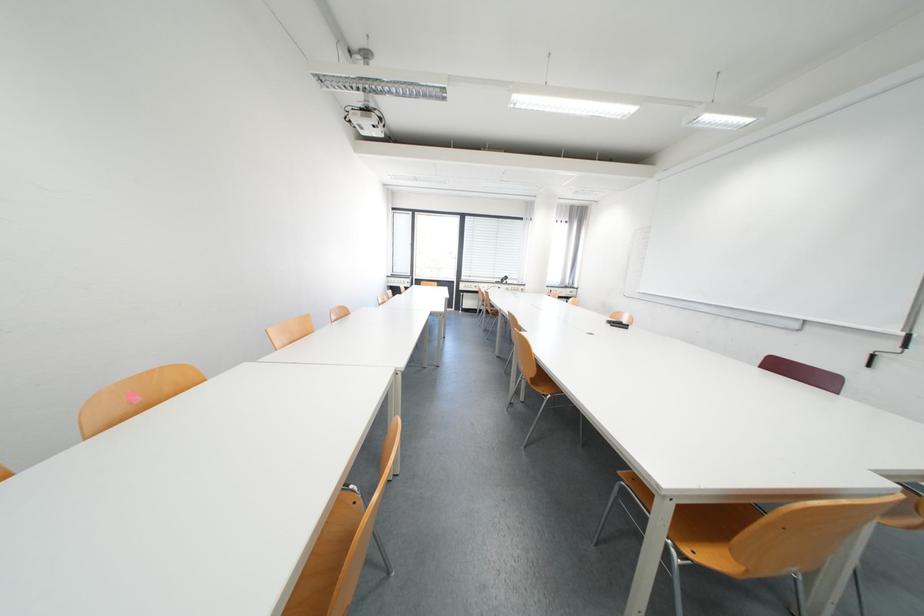
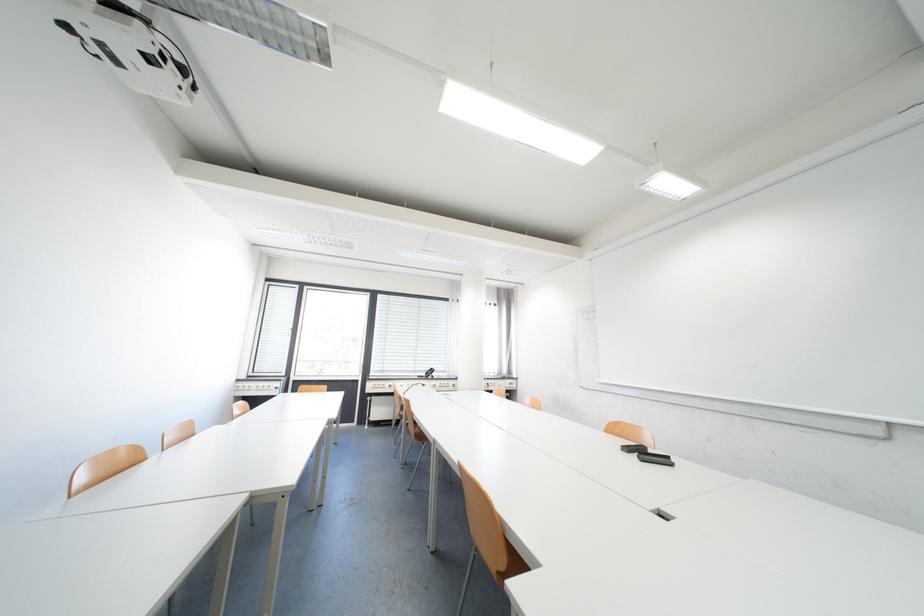
In the second image, find the point that corresponds to point 626,325 in the first image.

(652, 454)